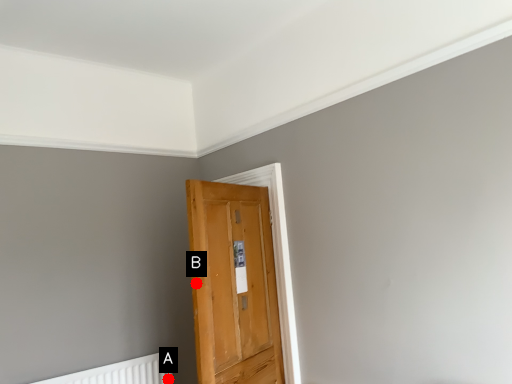
Question: Two points are circled on the image, labeled by A and B beside each circle. Among these points, which one is nearest to the camera?

Choices:
 (A) A is closer
 (B) B is closer

Answer: (B)